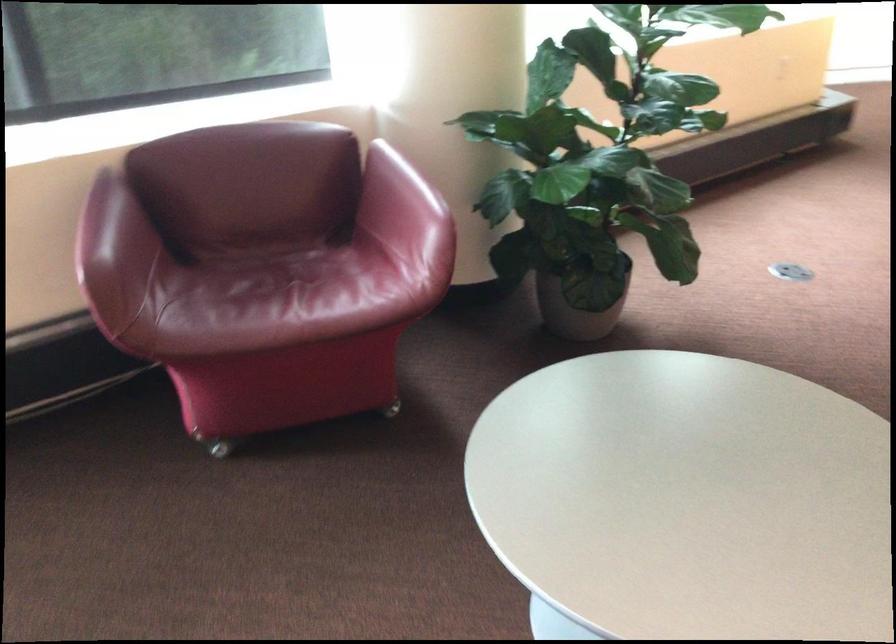
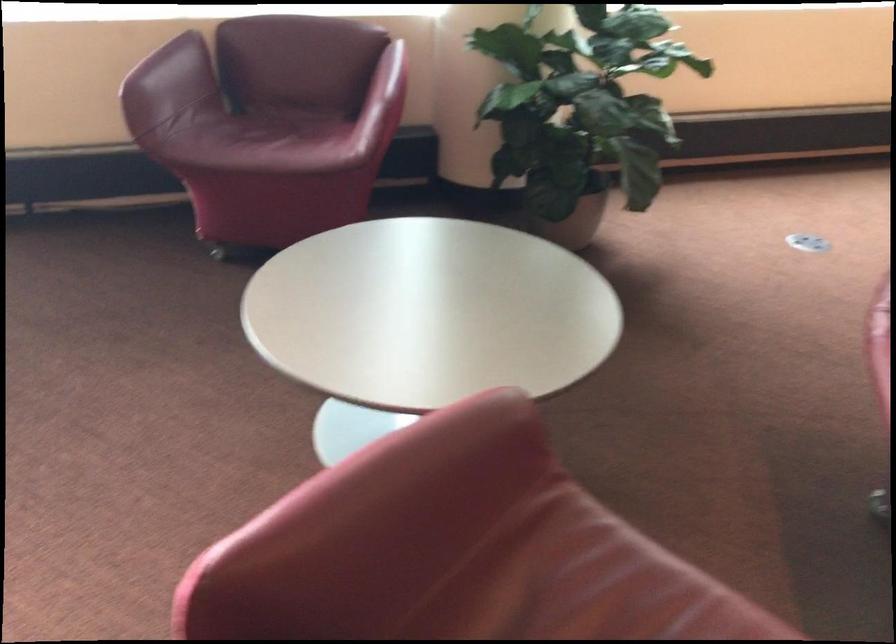
Question: Which direction would the cameraman need to move to produce the second image? Reply with the corresponding letter.

Choices:
 (A) Left
 (B) Right
 (C) Forward
 (D) Backward

Answer: (B)